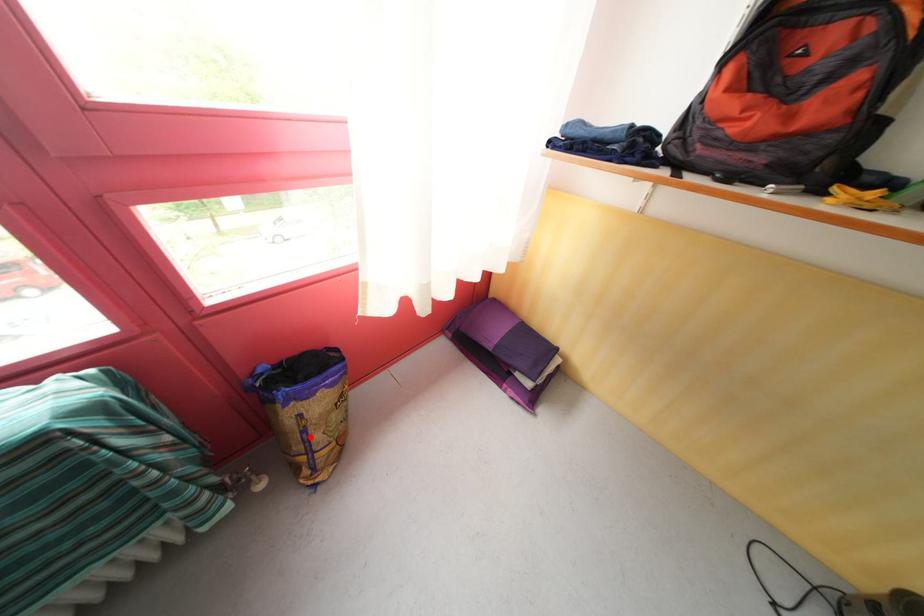
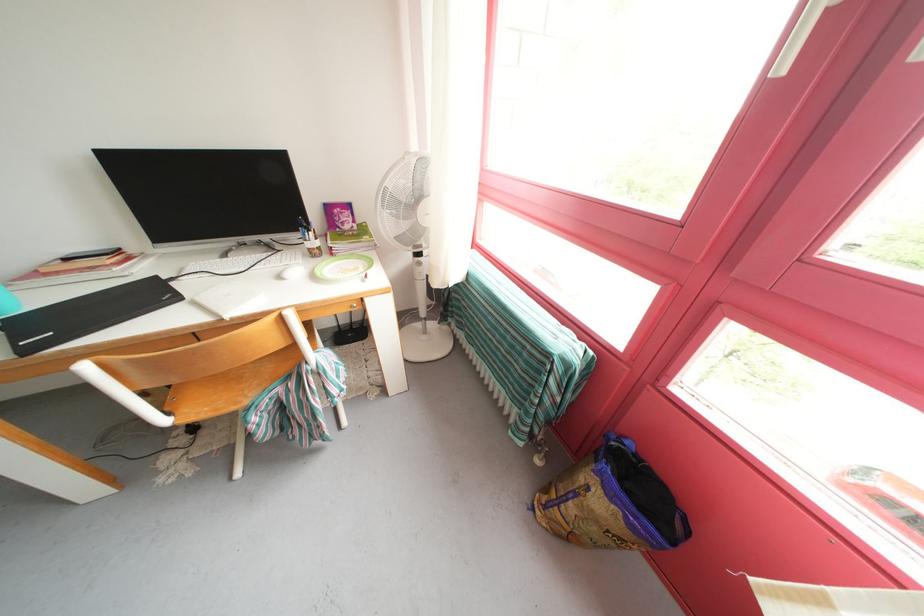
Find the pixel in the second image that matches the highlighted location in the first image.

(582, 499)